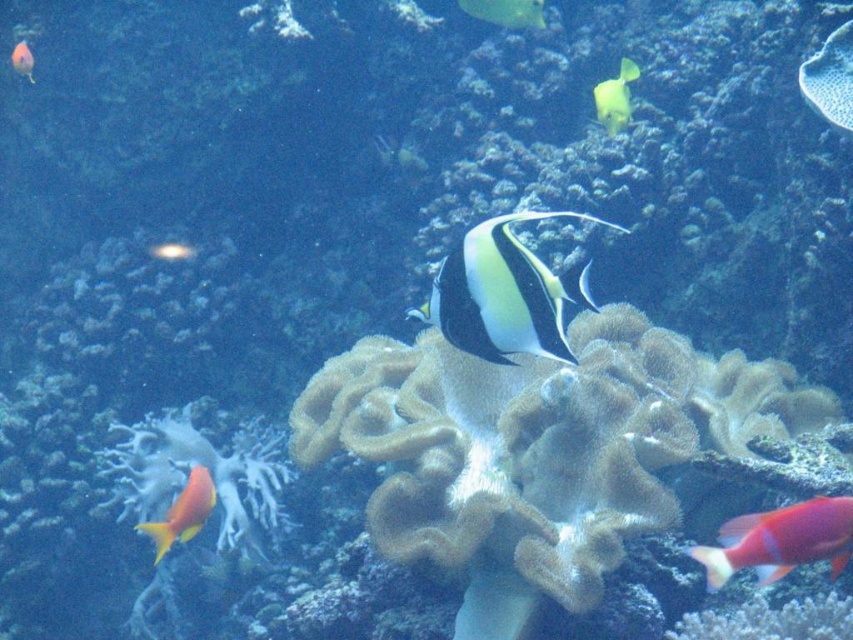
Question: Which object is farther from the camera taking this photo?

Choices:
 (A) yellow matte fish at upper right
 (B) shiny red fish at lower right
 (C) yellow matte fish at center

Answer: (C)

Question: Which of the following is the farthest from the observer?

Choices:
 (A) shiny red fish at lower right
 (B) yellow matte fish at upper right
 (C) yellow matte fish at center

Answer: (C)

Question: Can you confirm if shiny red fish at lower right is thinner than yellow matte fish at upper right?

Choices:
 (A) yes
 (B) no

Answer: (B)

Question: Where is black glossy fish at center located in relation to orange glossy fish at lower left in the image?

Choices:
 (A) above
 (B) below

Answer: (A)

Question: Is yellow matte fish at upper right to the left of yellow matte fish at center from the viewer's perspective?

Choices:
 (A) no
 (B) yes

Answer: (A)

Question: Among these points, which one is farthest from the camera?

Choices:
 (A) (540, 3)
 (B) (798, 557)
 (C) (612, 80)
 (D) (438, 323)

Answer: (C)